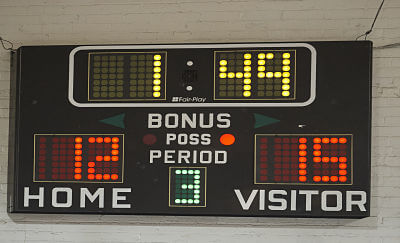
You are a GUI agent. You are given a task and a screenshot of the screen. Output one action in this format:
    pyautogui.click(x=<x>, y=<y>)
    Task: Click on the cable
    This screenshot has height=243, width=400.
    Given the screenshot: What is the action you would take?
    pyautogui.click(x=372, y=22), pyautogui.click(x=5, y=39)